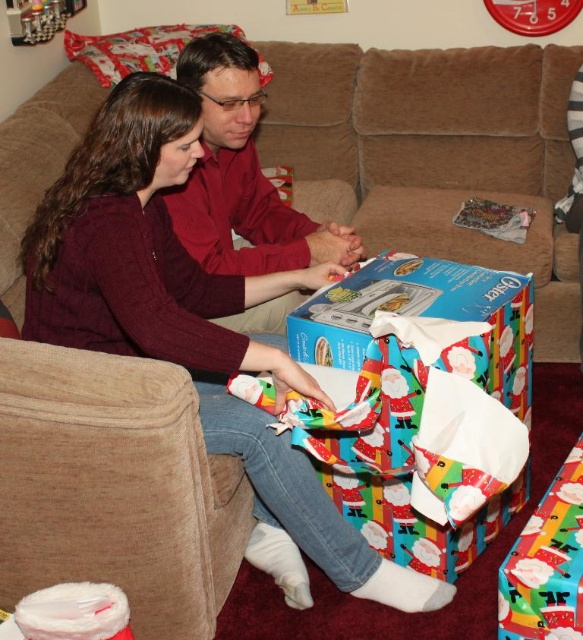
You are a delivery person trying to place a package between the brown fabric couch at center and the matte red shirt at center. The package is 24 inches long. Can you fit it in the space between them?

The space between the brown fabric couch at center and the matte red shirt at center is 23.72 inches. Since the package is 24 inches long, it is slightly too long to fit in the available space.

You are a photographer trying to capture a closeup of the matte maroon sweater at center and the matte red shirt at center. Since you want to focus on the sweater, which object should you ensure is closer to the camera lens?

The matte maroon sweater at center is positioned under the matte red shirt at center, so to focus on the sweater, you should ensure the matte red shirt at center is closer to the camera lens.

You are a fashion designer observing the scene. You need to determine which clothing item would require more fabric to produce between the matte maroon sweater at center and the matte red shirt at center. Which one would need more fabric?

The matte maroon sweater at center is larger in size than the matte red shirt at center, so it would require more fabric to produce.